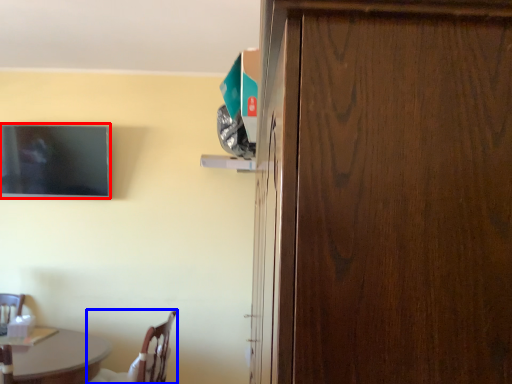
Question: Which point is further to the camera, television (highlighted by a red box) or chair (highlighted by a blue box)?

Choices:
 (A) television
 (B) chair

Answer: (A)